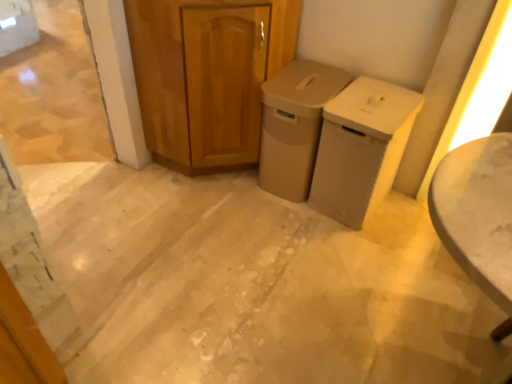
Locate an element on the screen. The height and width of the screenshot is (384, 512). free space in front of beige textured waste bin at center-right, acting as the second waste container starting from the left is located at coordinates (361, 248).